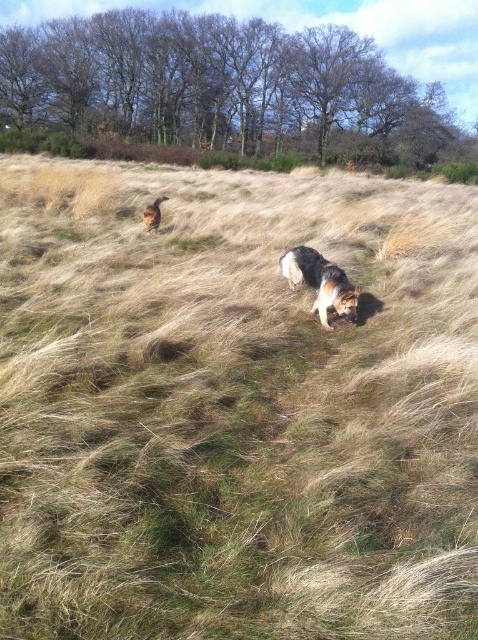
Looking at this image, you are a photographer trying to capture both the black and tan fur dog at center and the brown fur dog at upper center in a single shot. Based on their positions, which dog will appear larger in the photo?

The black and tan fur dog at center will appear larger in the photo because it is closer to the viewer than the brown fur dog at upper center.

You are a photographer trying to capture both the black and tan fur dog at center and the brown fur dog at upper center in a single frame. Based on their positions, which dog is closer to the left side of the image?

The brown fur dog at upper center is closer to the left side because the black and tan fur dog at center is positioned on the right side of it.

You are a photographer setting up a camera to capture both dogs in the scene. Given that the black and tan fur dog at center and the brown fur dog at upper center are both in the frame, which dog would require a wider lens aperture to ensure proper focus, and why?

The black and tan fur dog at center requires a wider lens aperture because it is larger in size compared to the brown fur dog at upper center, necessitating a larger depth of field to keep both subjects in focus.